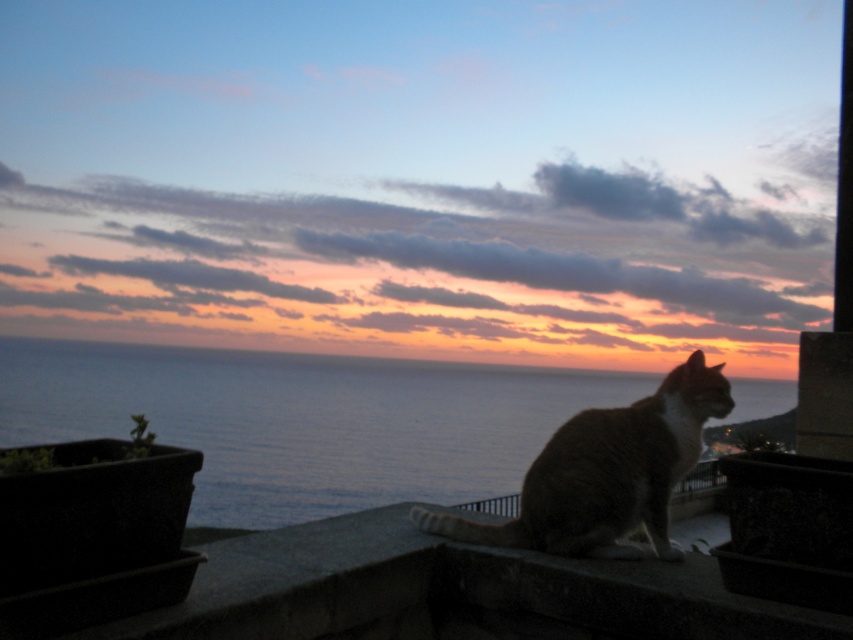
You are a photographer wanting to capture the tabby fur cat at center on the smooth concrete ledge at center. Can the cat fit entirely on the ledge without any part of its body hanging off?

The smooth concrete ledge at center is wider than the tabby fur cat at center, so the cat can fit entirely on the ledge without any part of its body hanging off.

You are standing at the point labeled as point (448, 592) in the image. Based on the scene description, what type of surface are you currently standing on?

The point (448, 592) corresponds to the smooth concrete ledge at center, so you are standing on a smooth concrete surface.